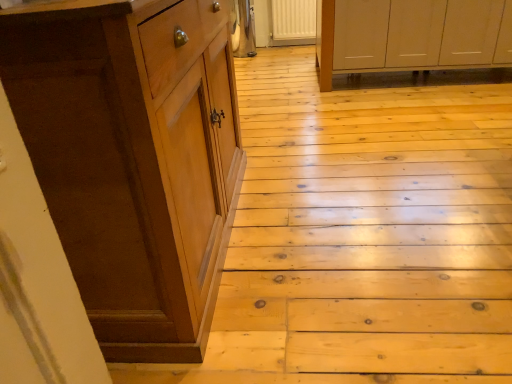
Locate an element on the screen. This screenshot has height=384, width=512. spots to the right of brown wood cabinet at left, which is the 2th cabinetry in top-to-bottom order is located at coordinates (351, 220).